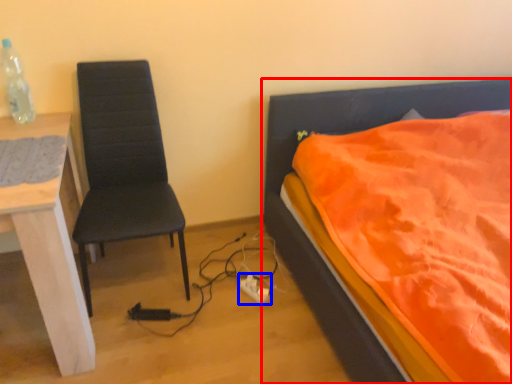
Question: Among these objects, which one is farthest to the camera, bed (highlighted by a red box) or power plugs and sockets (highlighted by a blue box)?

Choices:
 (A) bed
 (B) power plugs and sockets

Answer: (B)